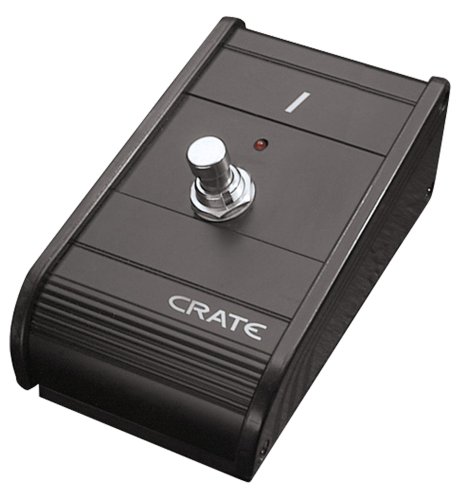
Locate an element on the screen. Image resolution: width=469 pixels, height=500 pixels. pillar is located at coordinates (214, 182).